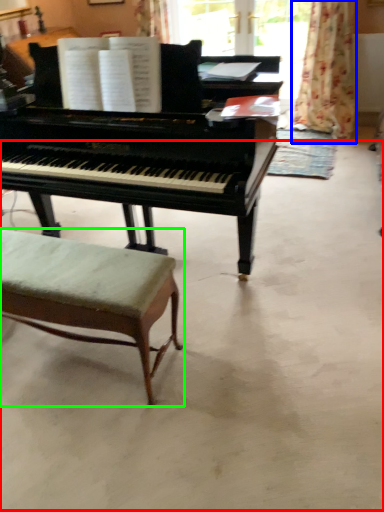
Question: Estimate the real-world distances between objects in this image. Which object is farther from concrete (highlighted by a red box), curtain (highlighted by a blue box) or stool (highlighted by a green box)?

Choices:
 (A) curtain
 (B) stool

Answer: (A)